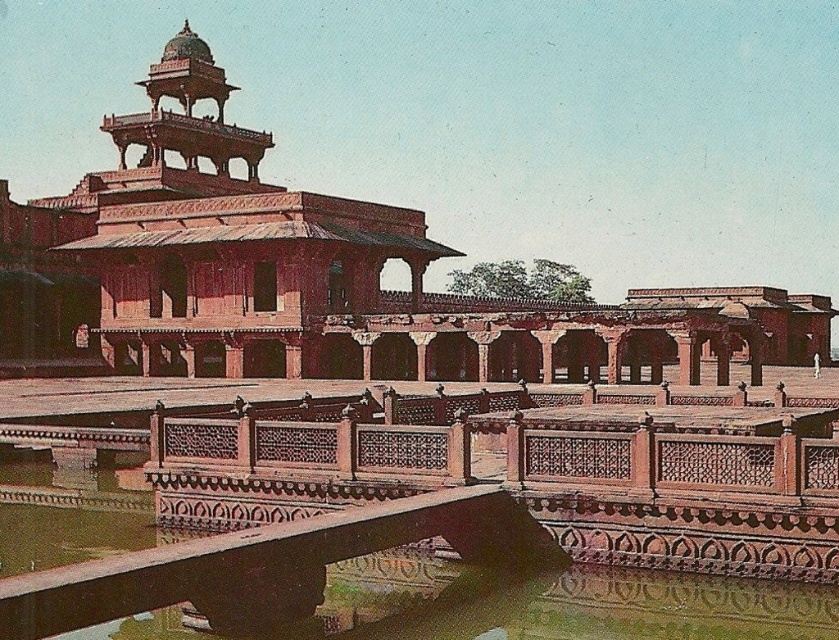
Who is more forward, (63,317) or (662,602)?

Positioned in front is point (662,602).

Which of these two, matte red stone palace at center or smooth stone water at center, stands shorter?

With less height is smooth stone water at center.

In order to click on matte red stone palace at center in this screenshot , I will do `click(306, 275)`.